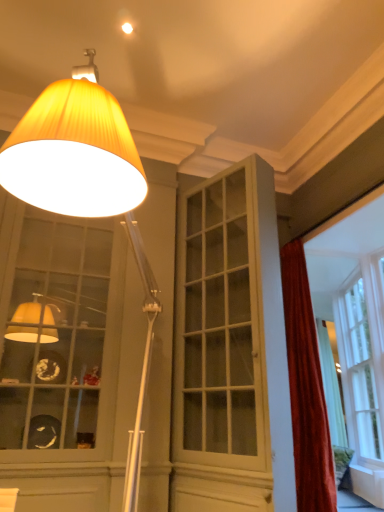
Question: In the image, is white glass window at right, which is the 1th window from right to left, on the left side or the right side of white glossy cabinet at center?

Choices:
 (A) right
 (B) left

Answer: (A)

Question: In the image, is white glass window at right, which is the 1th window from right to left, positioned in front of or behind white glossy cabinet at center?

Choices:
 (A) behind
 (B) front

Answer: (A)

Question: Considering the real-world distances, which object is closest to the velvet red curtain at right?

Choices:
 (A) matte glass cabinet at left, which appears as the 2th window when viewed from the right
 (B) white glossy cabinet at center
 (C) matte yellow fabric lampshade at upper left
 (D) white glass window at right, which is the 2th window from left to right

Answer: (B)

Question: Estimate the real-world distances between objects in this image. Which object is farther from the matte glass cabinet at left, marked as the first window in a left-to-right arrangement?

Choices:
 (A) white glossy cabinet at center
 (B) white glass window at right, which is the 1th window from right to left
 (C) matte yellow fabric lampshade at upper left
 (D) velvet red curtain at right

Answer: (B)